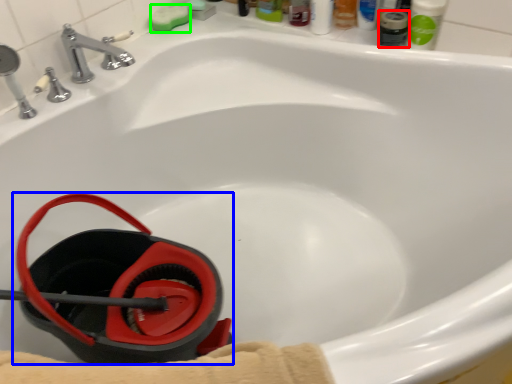
Question: Based on their relative distances, which object is farther from mouthwash (highlighted by a red box)? Choose from job (highlighted by a blue box) and soap (highlighted by a green box).

Choices:
 (A) job
 (B) soap

Answer: (A)